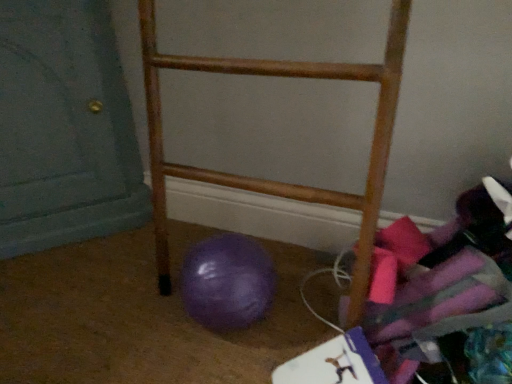
Question: Can you confirm if purple rubber ball at lower left is taller than wooden rack at center?

Choices:
 (A) no
 (B) yes

Answer: (A)

Question: Is purple rubber ball at lower left at the left side of wooden rack at center?

Choices:
 (A) no
 (B) yes

Answer: (B)

Question: Is purple rubber ball at lower left next to wooden rack at center?

Choices:
 (A) no
 (B) yes

Answer: (A)

Question: From the image's perspective, does purple rubber ball at lower left appear higher than wooden rack at center?

Choices:
 (A) yes
 (B) no

Answer: (B)

Question: From a real-world perspective, is purple rubber ball at lower left positioned over wooden rack at center based on gravity?

Choices:
 (A) no
 (B) yes

Answer: (A)

Question: From a real-world perspective, is matte teal door at lower left above or below purple rubber ball at lower left?

Choices:
 (A) above
 (B) below

Answer: (A)

Question: Is matte teal door at lower left to the left or to the right of purple rubber ball at lower left in the image?

Choices:
 (A) left
 (B) right

Answer: (A)

Question: From their relative heights in the image, would you say matte teal door at lower left is taller or shorter than purple rubber ball at lower left?

Choices:
 (A) tall
 (B) short

Answer: (A)

Question: From the image's perspective, is matte teal door at lower left above or below purple rubber ball at lower left?

Choices:
 (A) above
 (B) below

Answer: (A)

Question: Relative to wooden rack at center, is matte teal door at lower left in front or behind?

Choices:
 (A) behind
 (B) front

Answer: (A)

Question: Considering the positions of matte teal door at lower left and wooden rack at center in the image, is matte teal door at lower left taller or shorter than wooden rack at center?

Choices:
 (A) tall
 (B) short

Answer: (A)

Question: Looking at their shapes, would you say matte teal door at lower left is wider or thinner than wooden rack at center?

Choices:
 (A) thin
 (B) wide

Answer: (B)

Question: Is matte teal door at lower left inside or outside of wooden rack at center?

Choices:
 (A) inside
 (B) outside

Answer: (B)

Question: In the image, is purple rubber ball at lower left on the left side or the right side of wooden rack at center?

Choices:
 (A) right
 (B) left

Answer: (B)

Question: From a real-world perspective, is purple rubber ball at lower left positioned above or below wooden rack at center?

Choices:
 (A) above
 (B) below

Answer: (B)